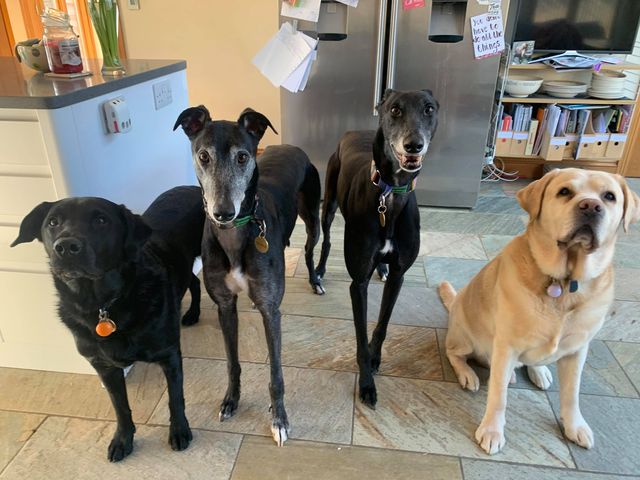
You are a GUI agent. You are given a task and a screenshot of the screen. Output one action in this format:
    pyautogui.click(x=<x>, y=<y>)
    Task: Click on the candle
    
    Given the screenshot: What is the action you would take?
    pyautogui.click(x=73, y=49)